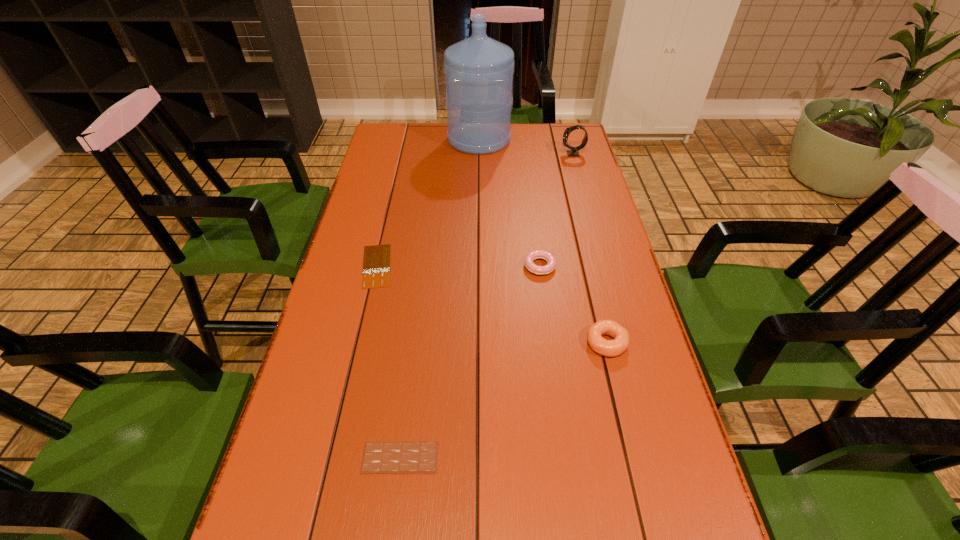
Identify the location of free point between the third shortest object and the leftmost object. The width and height of the screenshot is (960, 540). (458, 266).

Locate an element on the screen. Image resolution: width=960 pixels, height=540 pixels. vacant area between the fourth shortest object and the taller chocolate bar is located at coordinates point(503,400).

Locate an element on the screen. vacant point located between the third tallest object and the fifth tallest object is located at coordinates (503, 400).

Locate an element on the screen. unoccupied area between the shorter chocolate bar and the third object from right to left is located at coordinates (458, 266).

The image size is (960, 540). In order to click on unoccupied position between the left chocolate bar and the watch in this screenshot , I will do `click(474, 210)`.

The height and width of the screenshot is (540, 960). I want to click on unoccupied position between the fifth farthest object and the fifth shortest object, so click(589, 248).

Find the location of a particular element. The image size is (960, 540). vacant region between the water jug and the second tallest object is located at coordinates (526, 147).

This screenshot has height=540, width=960. I want to click on blank region between the tallest object and the nearer chocolate bar, so click(440, 299).

In order to click on object that is the fifth closest to the fourth object from left to right in this screenshot , I will do `click(478, 70)`.

Where is `object that can be found as the closest to the left doughnut`? object that can be found as the closest to the left doughnut is located at coordinates (610, 348).